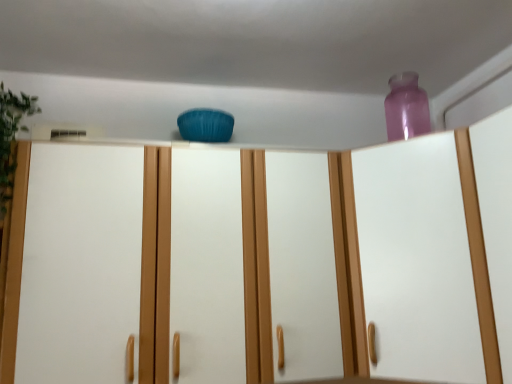
Question: Is transparent purple bottle at upper right wider than matte blue cushion at center?

Choices:
 (A) no
 (B) yes

Answer: (A)

Question: Is transparent purple bottle at upper right at the left side of matte blue cushion at center?

Choices:
 (A) yes
 (B) no

Answer: (B)

Question: Considering the relative sizes of transparent purple bottle at upper right and matte blue cushion at center in the image provided, is transparent purple bottle at upper right thinner than matte blue cushion at center?

Choices:
 (A) no
 (B) yes

Answer: (B)

Question: Is transparent purple bottle at upper right far away from matte blue cushion at center?

Choices:
 (A) yes
 (B) no

Answer: (B)

Question: From a real-world perspective, is transparent purple bottle at upper right located beneath matte blue cushion at center?

Choices:
 (A) yes
 (B) no

Answer: (B)

Question: Is matte blue cushion at center at the back of transparent purple bottle at upper right?

Choices:
 (A) yes
 (B) no

Answer: (B)

Question: Would you say matte blue cushion at center is part of green leafy plant at left's contents?

Choices:
 (A) no
 (B) yes

Answer: (A)

Question: Is green leafy plant at left with matte blue cushion at center?

Choices:
 (A) yes
 (B) no

Answer: (B)

Question: Does green leafy plant at left have a lesser height compared to matte blue cushion at center?

Choices:
 (A) no
 (B) yes

Answer: (B)

Question: From a real-world perspective, is green leafy plant at left under matte blue cushion at center?

Choices:
 (A) no
 (B) yes

Answer: (A)

Question: Could you tell me if green leafy plant at left is turned towards matte blue cushion at center?

Choices:
 (A) no
 (B) yes

Answer: (B)

Question: Can you confirm if green leafy plant at left is bigger than matte blue cushion at center?

Choices:
 (A) no
 (B) yes

Answer: (A)

Question: From the image's perspective, is green leafy plant at left located above transparent plastic vase at upper right?

Choices:
 (A) yes
 (B) no

Answer: (A)